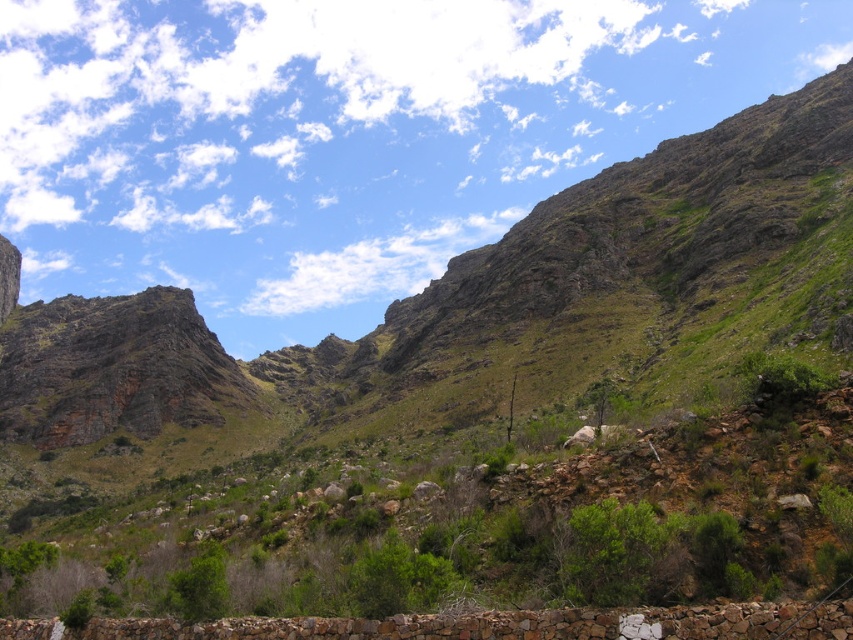
Question: Does green leafy shrubs at center have a lesser width compared to brown stone wall at lower center?

Choices:
 (A) no
 (B) yes

Answer: (A)

Question: Does green leafy shrubs at center have a greater width compared to brown stone wall at lower center?

Choices:
 (A) yes
 (B) no

Answer: (A)

Question: Considering the relative positions of green leafy shrubs at center and brown stone wall at lower center in the image provided, where is green leafy shrubs at center located with respect to brown stone wall at lower center?

Choices:
 (A) right
 (B) left

Answer: (B)